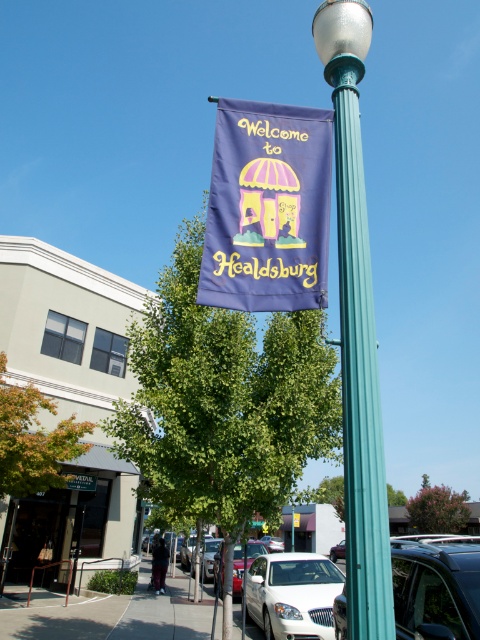
Question: Considering the real-world distances, which object is farthest from the green leafy tree at center?

Choices:
 (A) metallic silver car at lower right
 (B) white glossy sedan at lower center
 (C) teal metallic street light at center
 (D) green leafy tree at lower left

Answer: (C)

Question: Among these points, which one is farthest from the camera?

Choices:
 (A) (354, 476)
 (B) (282, 605)

Answer: (B)

Question: Is the position of green leafy tree at center less distant than that of green leafy tree at lower left?

Choices:
 (A) yes
 (B) no

Answer: (A)

Question: Which object is farther from the camera taking this photo?

Choices:
 (A) green leafy tree at lower left
 (B) purple fabric banner at upper center
 (C) white glossy sedan at lower center

Answer: (B)

Question: Does purple fabric banner at center have a larger size compared to metallic silver sedan at lower center?

Choices:
 (A) yes
 (B) no

Answer: (B)

Question: Is green leafy tree at center further to camera compared to metallic silver car at lower right?

Choices:
 (A) no
 (B) yes

Answer: (A)